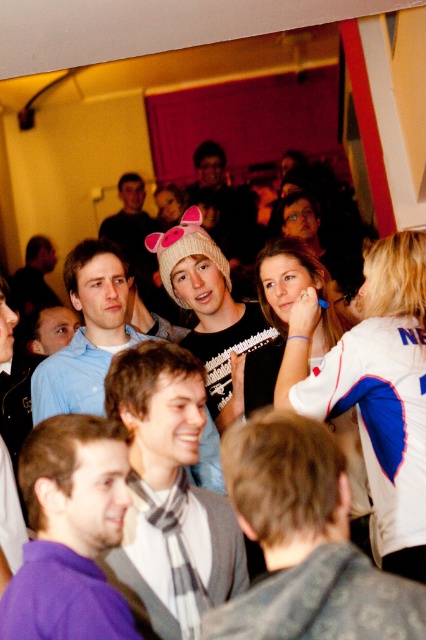
Does gray sweater at center appear on the right side of white knit hat at center?

Indeed, gray sweater at center is positioned on the right side of white knit hat at center.

Which is above, gray sweater at center or white knit hat at center?

white knit hat at center is higher up.

Between point (230, 497) and point (172, 278), which one is positioned behind?

The point (172, 278) is behind.

The width and height of the screenshot is (426, 640). I want to click on gray sweater at center, so click(x=305, y=541).

Based on the photo, does gray sweater at center have a greater width compared to purple fabric at center?

Yes, gray sweater at center is wider than purple fabric at center.

Does gray sweater at center appear on the right side of purple fabric at center?

Indeed, gray sweater at center is positioned on the right side of purple fabric at center.

Locate an element on the screen. The width and height of the screenshot is (426, 640). gray sweater at center is located at coordinates (305, 541).

How distant is gray scarf at center from purple fabric at center?

gray scarf at center and purple fabric at center are 14.54 inches apart from each other.

Is gray scarf at center smaller than purple fabric at center?

Incorrect, gray scarf at center is not smaller in size than purple fabric at center.

Between point (127, 410) and point (98, 440), which one is positioned behind?

The point (127, 410) is more distant.

In order to click on gray scarf at center in this screenshot , I will do `click(172, 490)`.